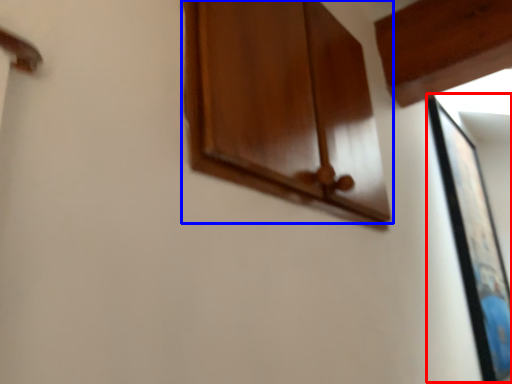
Question: Which object is further to the camera taking this photo, picture frame (highlighted by a red box) or cabinetry (highlighted by a blue box)?

Choices:
 (A) picture frame
 (B) cabinetry

Answer: (A)